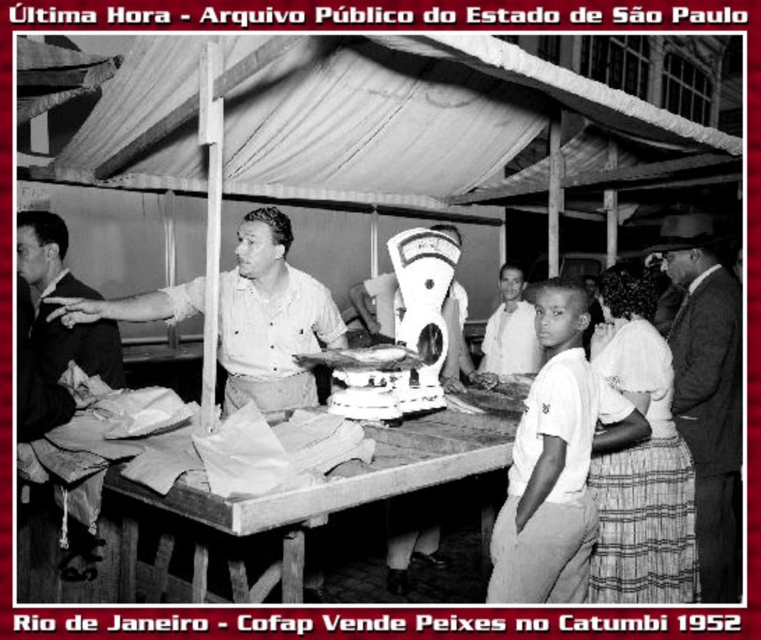
Question: Does striped cotton skirt at lower right come behind smooth white shirt at center?

Choices:
 (A) no
 (B) yes

Answer: (A)

Question: Which object is the farthest from the smooth dark suit at right?

Choices:
 (A) wooden table at center
 (B) smooth white shirt at center
 (C) matte white shirt at center
 (D) striped cotton skirt at lower right

Answer: (C)

Question: Among these objects, which one is farthest from the camera?

Choices:
 (A) wooden table at center
 (B) smooth white shirt at left
 (C) white cotton shirt at center

Answer: (B)

Question: Can you confirm if matte white shirt at center is thinner than smooth white shirt at left?

Choices:
 (A) yes
 (B) no

Answer: (B)

Question: Is matte white shirt at center smaller than smooth white shirt at left?

Choices:
 (A) no
 (B) yes

Answer: (A)

Question: Among these objects, which one is farthest from the camera?

Choices:
 (A) matte white shirt at center
 (B) smooth white shirt at left
 (C) white cotton shirt at center
 (D) striped cotton skirt at lower right

Answer: (B)